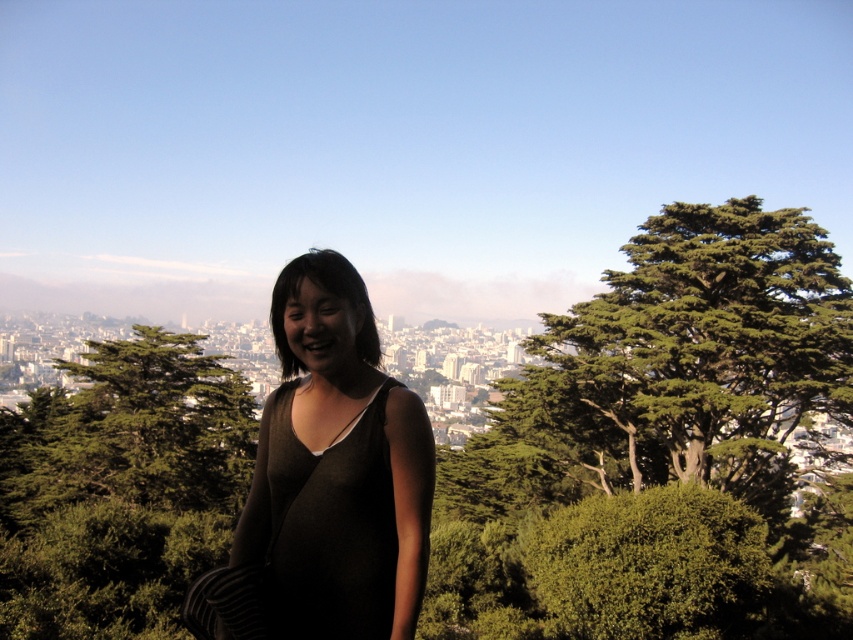
Based on the scene description, where is the green leafy tree at center located in the image?

The green leafy tree at center is located at point (120, 490) in the image.

You are a photographer trying to capture a photo of the green leafy tree at center and the matte black dress at center. Given that your camera has a maximum focus range of 90 meters, will you be able to focus on both subjects simultaneously?

The green leafy tree at center and matte black dress at center are 93.09 meters apart from each other. Since the camera can only focus up to 90 meters, it cannot focus on both subjects at the same time.